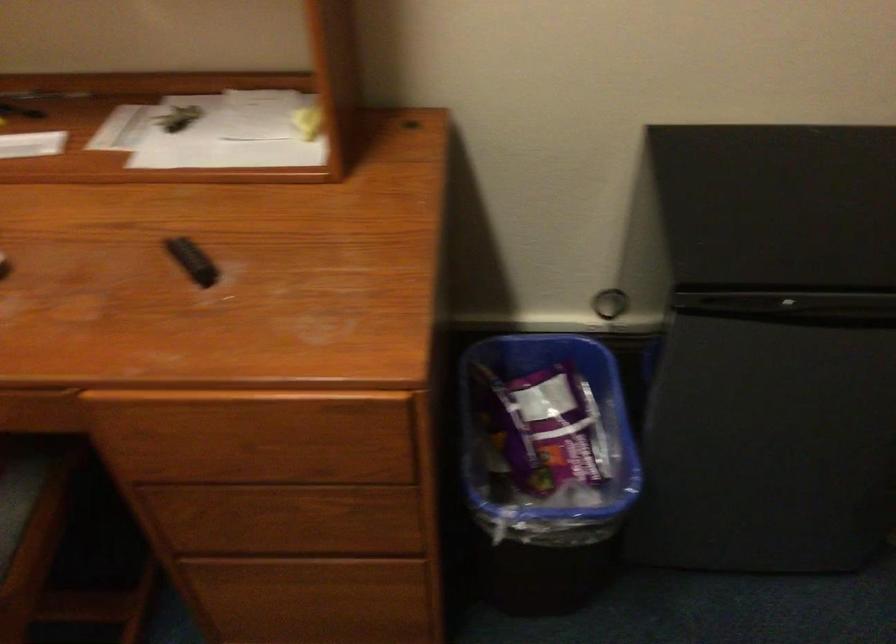
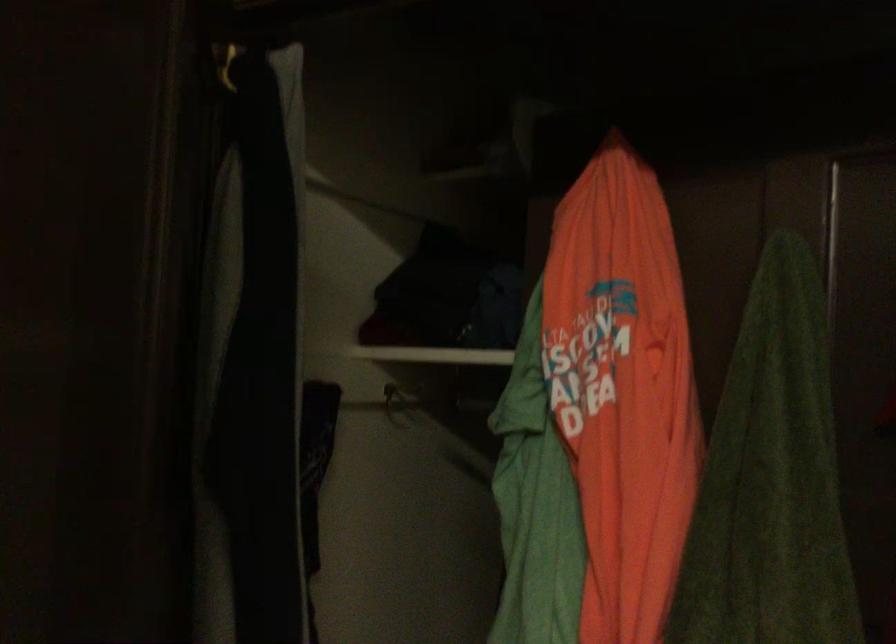
Based on the continuous images, in which direction is the camera rotating?

The camera's rotation is toward right-up.